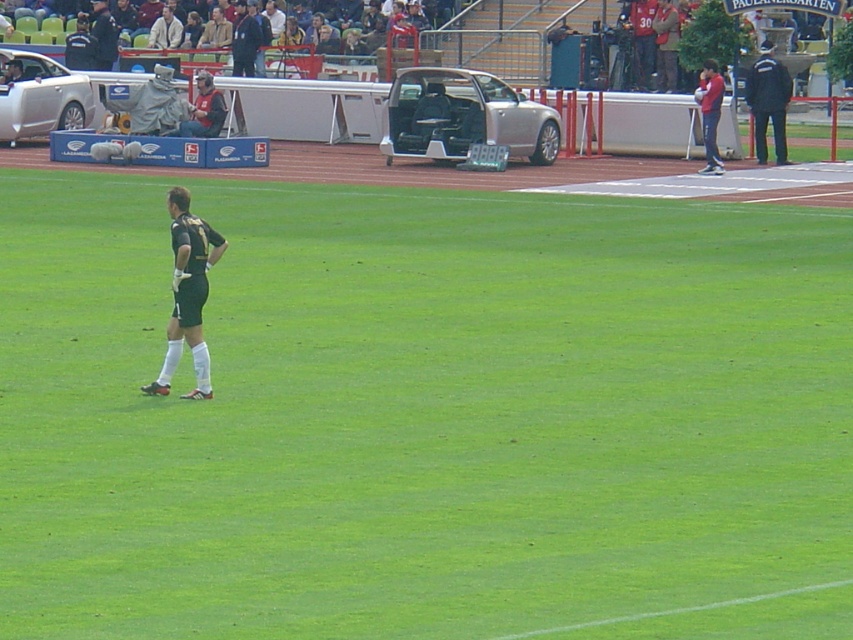
You are a photographer trying to capture a wide shot of the soccer field. You need to include both the green grass field at center and the dark green jersey at left in your photo. Given their sizes, which object should you focus on to ensure both are visible in the frame?

The green grass field at center is larger than the dark green jersey at left, so focusing on the field will allow both objects to fit within the frame since it occupies more space.

You are a photographer positioned at the edge of the soccer field. You want to capture both the satin silver car at center and the red cotton shirt at upper right in your shot. Which object should you focus on first if you want to ensure both are in clear view without adjusting your camera settings?

The satin silver car at center has a lesser height compared to the red cotton shirt at upper right. Therefore, focusing on the red cotton shirt at upper right first will help ensure both objects are in clear focus since it is taller and might be further away, requiring proper depth of field adjustment.

You are a photographer standing at the edge of the soccer field. You want to take a photo that includes both the green grass field at center and the dark green jersey at left. Which object should you zoom in on to ensure both are in focus?

The green grass field at center is much taller than the dark green jersey at left, so you should zoom in on the green grass field at center to ensure both are in focus.